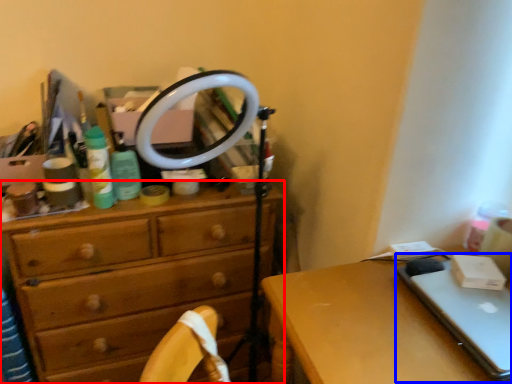
Question: Which object appears farthest to the camera in this image, chest of drawers (highlighted by a red box) or laptop (highlighted by a blue box)?

Choices:
 (A) chest of drawers
 (B) laptop

Answer: (A)